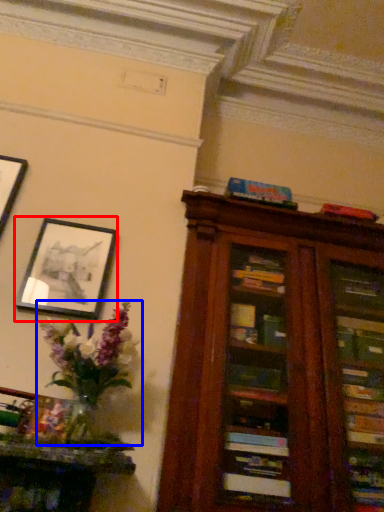
Question: Which of the following is the closest to the observer, picture frame (highlighted by a red box) or floral arrangement (highlighted by a blue box)?

Choices:
 (A) picture frame
 (B) floral arrangement

Answer: (B)